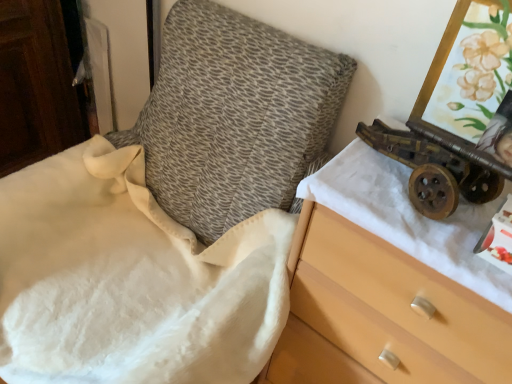
You are a GUI agent. You are given a task and a screenshot of the screen. Output one action in this format:
    pyautogui.click(x=<x>, y=<y>)
    Task: Click on the free spot below rusty metal cannon at right (from a real-world perspective)
    
    Given the screenshot: What is the action you would take?
    pyautogui.click(x=396, y=174)